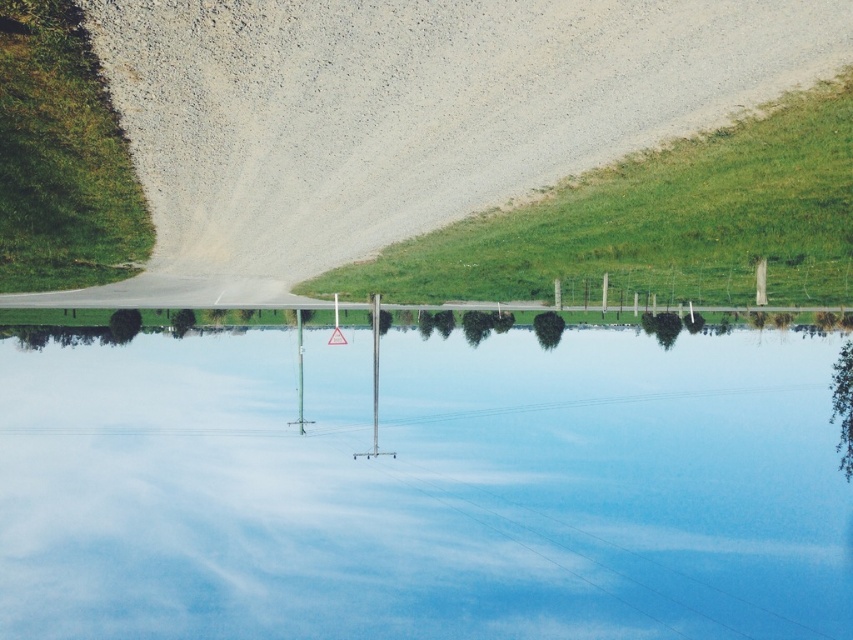
You are a hiker who wants to cross the transparent glass lake at center. You see the green grass at left nearby. Which path would allow you to cross the lake safely?

The green grass at left is narrower than the transparent glass lake at center, so you should choose the path on the green grass at left to cross safely since it is narrower and more stable.

You are standing at the edge of the transparent glass lake at center and want to walk to the green grass at upper right. Is the distance you need to cover more than 10 meters?

The transparent glass lake at center might be wider than green grass at upper right, but without specific distance information, it is impossible to determine if the distance to the green grass at upper right is more than 10 meters.